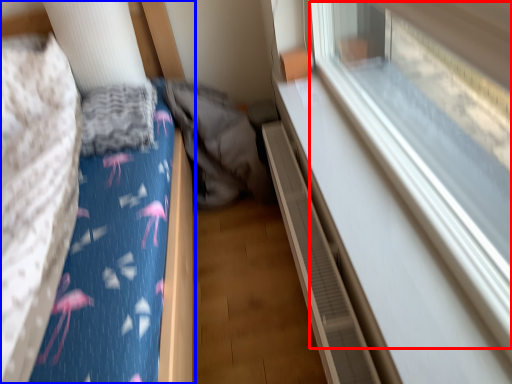
Question: Which object is further to the camera taking this photo, train window (highlighted by a red box) or furniture (highlighted by a blue box)?

Choices:
 (A) train window
 (B) furniture

Answer: (B)